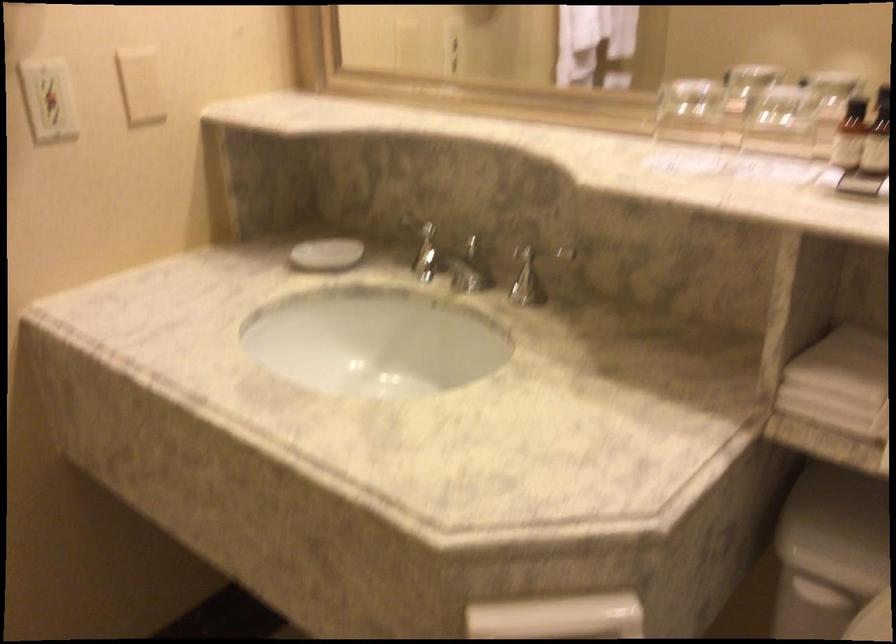
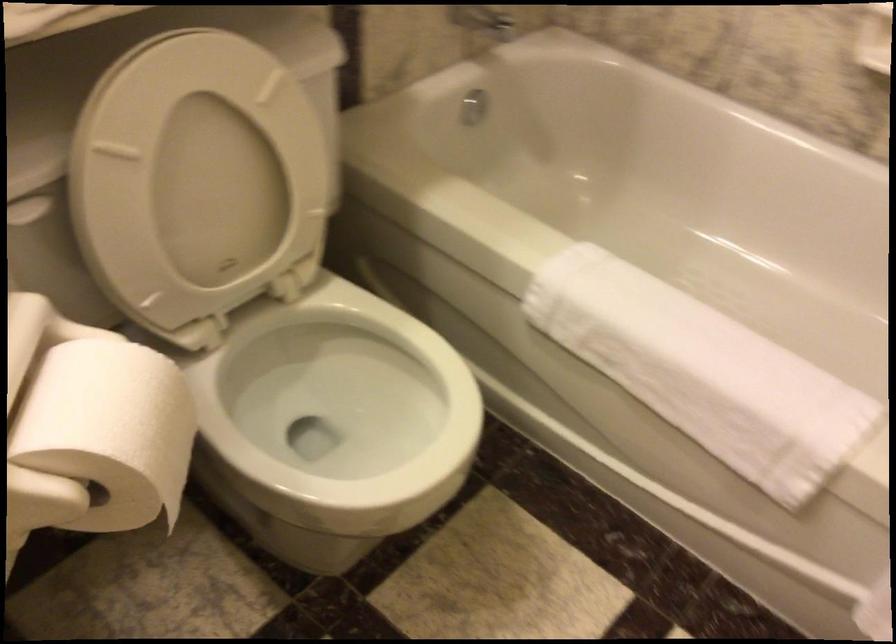
Consider the image. Based on the continuous images, in which direction is the camera rotating?

The rotation direction of the camera is right-down.